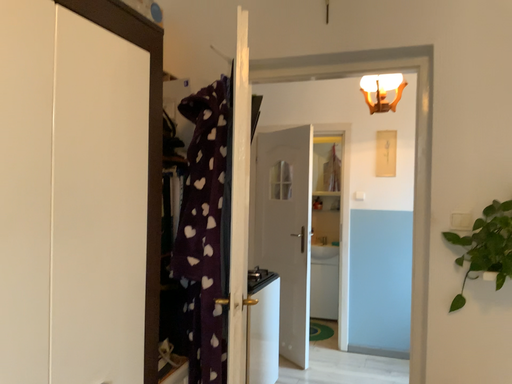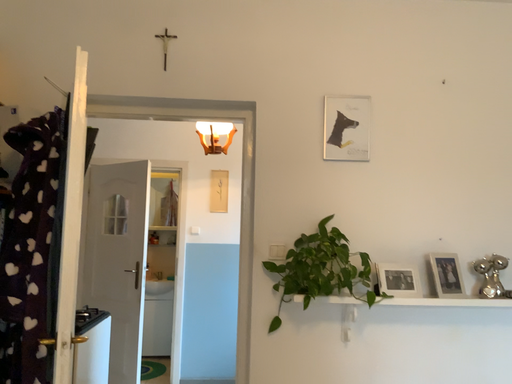
Question: Which way did the camera rotate in the video?

Choices:
 (A) rotated left
 (B) rotated right

Answer: (B)